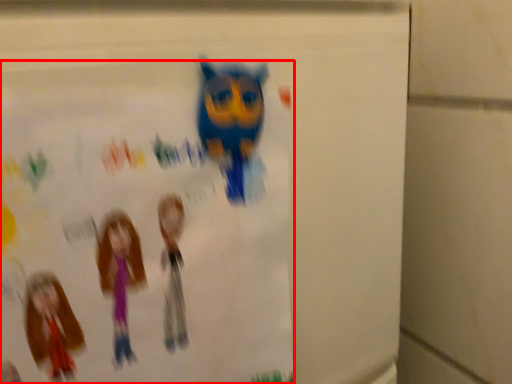
Question: From the image's perspective, what is the correct spatial relationship of poster (annotated by the red box) in relation to toy?

Choices:
 (A) above
 (B) below

Answer: (B)